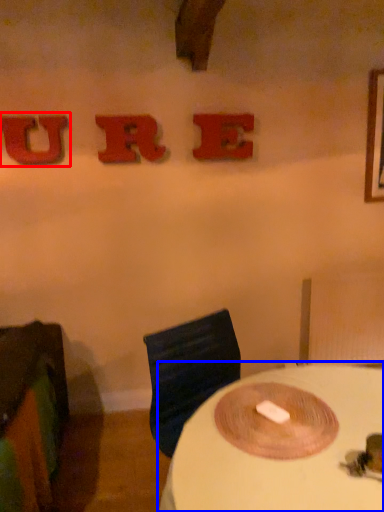
Question: Among these objects, which one is farthest to the camera, alphabet (highlighted by a red box) or table (highlighted by a blue box)?

Choices:
 (A) alphabet
 (B) table

Answer: (A)